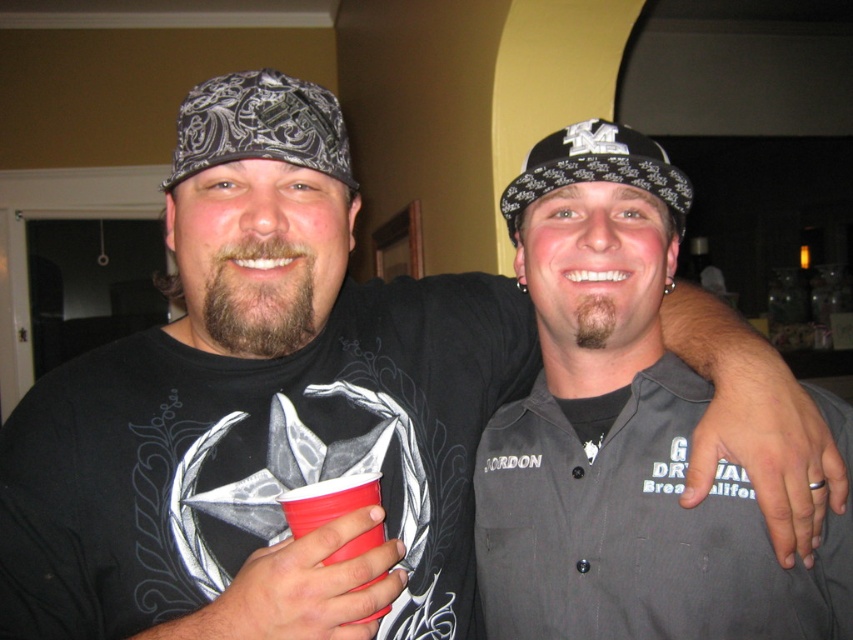
Which of these two, gray button-up shirt at center or black printed bandana at upper left, stands shorter?

black printed bandana at upper left is shorter.

Between gray button-up shirt at center and black printed bandana at upper left, which one appears on the left side from the viewer's perspective?

Positioned to the left is black printed bandana at upper left.

Between point (836, 417) and point (276, 140), which one is positioned in front?

Point (276, 140) is in front.

In order to click on gray button-up shirt at center in this screenshot , I will do `click(621, 433)`.

How far apart are black bandana at center and rubberized plastic cup at lower left?

black bandana at center and rubberized plastic cup at lower left are 15.38 inches apart from each other.

Can you confirm if black bandana at center is bigger than rubberized plastic cup at lower left?

Yes.

The height and width of the screenshot is (640, 853). What do you see at coordinates (596, 168) in the screenshot? I see `black bandana at center` at bounding box center [596, 168].

I want to click on black bandana at center, so click(596, 168).

Between point (238, 109) and point (352, 506), which one is positioned in front?

Positioned in front is point (352, 506).

The width and height of the screenshot is (853, 640). In order to click on black printed bandana at upper left in this screenshot , I will do `click(260, 125)`.